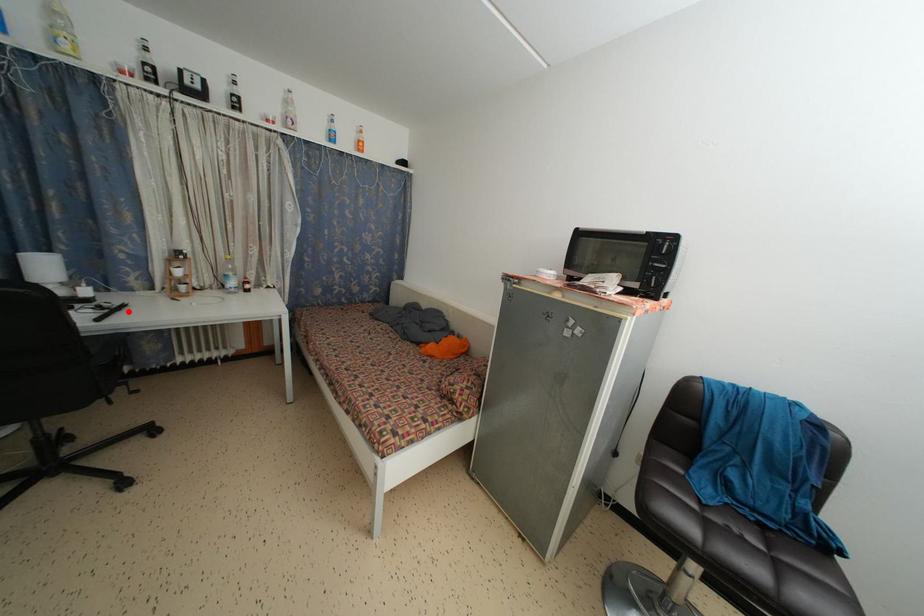
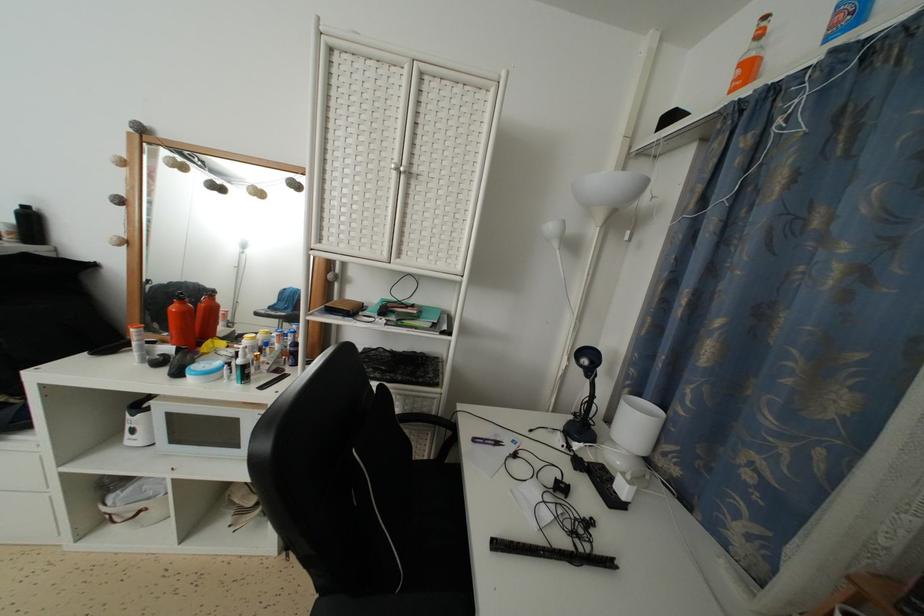
In the second image, find the point that corresponds to the highlighted location in the first image.

(614, 569)